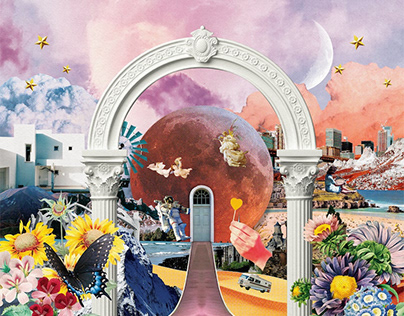
The image size is (404, 316). I want to click on door, so click(x=200, y=223).